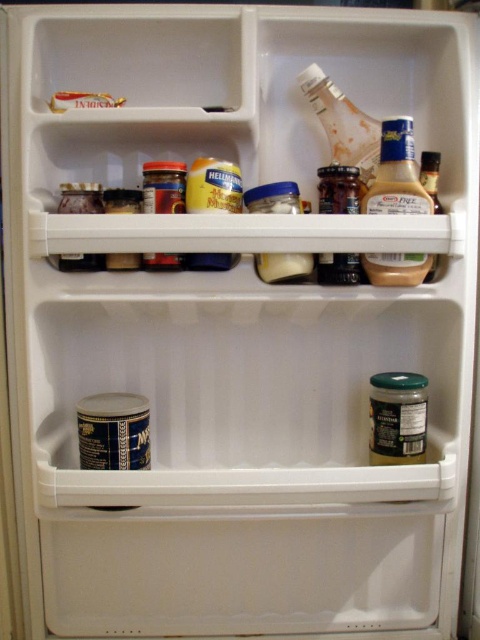
Question: Which of the following is the closest to the observer?

Choices:
 (A) translucent plastic mustard at upper right
 (B) translucent plastic jar at center
 (C) matte plastic container at upper left
 (D) green matte jar at lower right

Answer: (A)

Question: Does translucent plastic mustard at upper right appear on the left side of translucent plastic jar at center?

Choices:
 (A) no
 (B) yes

Answer: (A)

Question: Can you confirm if green matte jar at lower right is smaller than matte plastic jar at upper center?

Choices:
 (A) no
 (B) yes

Answer: (A)

Question: Which is nearer to the translucent plastic jar at center?

Choices:
 (A) yellow matte mustard at center
 (B) translucent plastic bottle at upper right
 (C) green matte jar at lower right
 (D) matte plastic jar at upper center

Answer: (B)

Question: Which object is closer to the camera taking this photo?

Choices:
 (A) matte plastic container at upper left
 (B) translucent plastic jar at center
 (C) matte yellow plastic mustard at center

Answer: (C)

Question: Is green matte jar at lower right below translucent plastic jar at center?

Choices:
 (A) yes
 (B) no

Answer: (A)